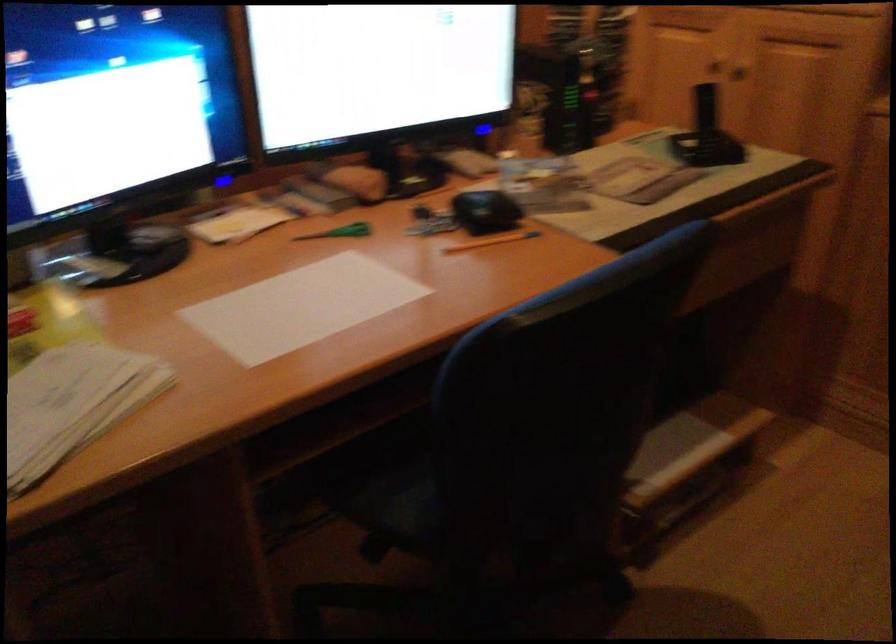
Question: Based on the continuous images, in which direction is the camera rotating? Reply with the corresponding letter.

Choices:
 (A) Left
 (B) Right
 (C) Up
 (D) Down

Answer: (B)